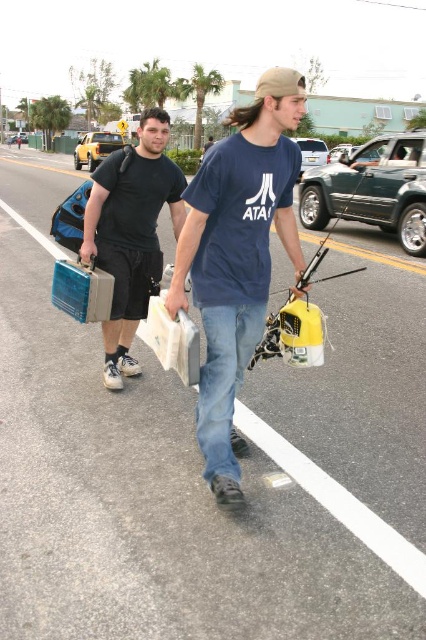
Where is the matte blue shirt at center located?

The matte blue shirt at center is located at point 0.402 in the x coordinate and 0.559 in the y coordinate.